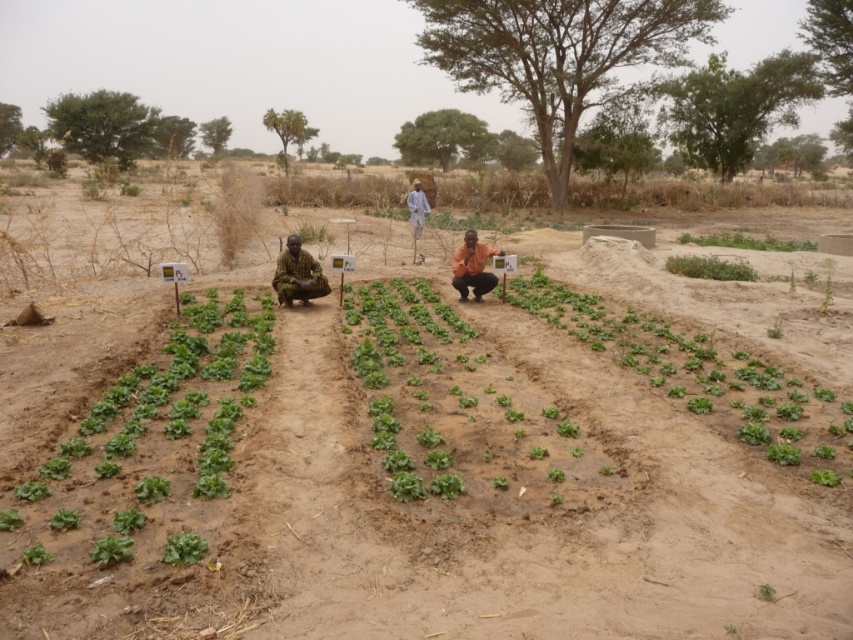
Who is lower down, green leafy at left or orange fabric person at center?

green leafy at left is lower down.

Can you confirm if green leafy at left is wider than orange fabric person at center?

Yes.

Which is behind, point (59, 525) or point (480, 280)?

Point (480, 280)

Where is `green leafy at left`? green leafy at left is located at coordinates (149, 435).

Does green leafy vegetable at center have a lesser height compared to brown textured fabric at center?

Correct, green leafy vegetable at center is not as tall as brown textured fabric at center.

Where is `green leafy vegetable at center`? The height and width of the screenshot is (640, 853). green leafy vegetable at center is located at coordinates (457, 406).

Between brown textured fabric at center and green leafy plant at lower right, which one appears on the left side from the viewer's perspective?

Positioned to the left is brown textured fabric at center.

Between point (323, 282) and point (792, 248), which one is positioned behind?

Point (792, 248)

Locate an element on the screen. This screenshot has height=640, width=853. brown textured fabric at center is located at coordinates (297, 275).